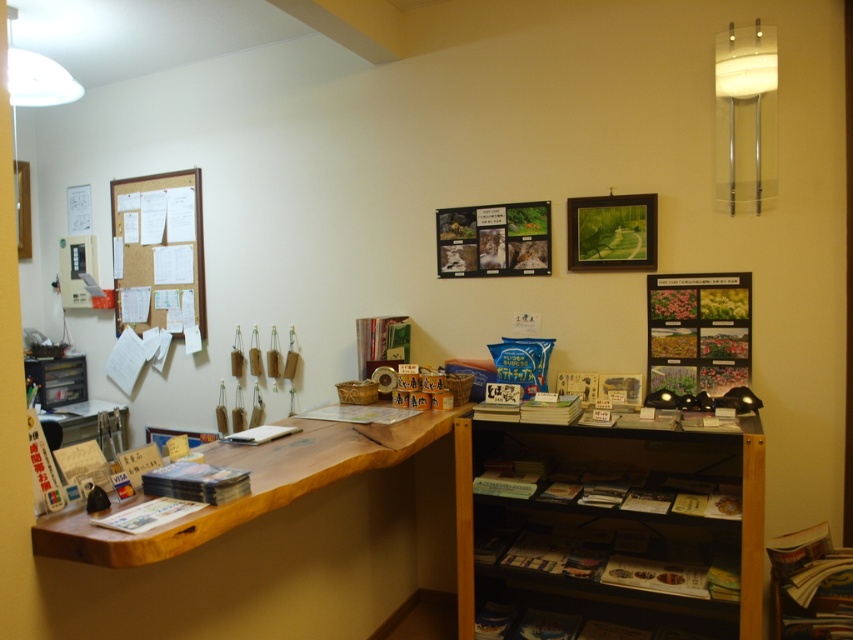
You are standing in the shop and want to hang a new poster. The wooden picture frame at upper center is located at point (612,230). Is there enough space to hang the poster above the wooden counter on the left without overlapping the frame?

The wooden picture frame at upper center is located at point (612,230). Since the frame is at that coordinate, you need to ensure the poster is placed in an area that doesn

You are organizing a display in the shop and need to place both the light blue paper at center and the white paper book at lower left on a shelf. Which object should you place first if you want to arrange them from widest to narrowest?

The light blue paper at center is wider than the white paper book at lower left, so you should place the light blue paper at center first when arranging from widest to narrowest.